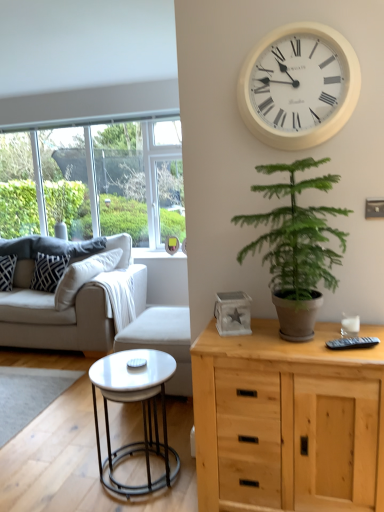
You are a GUI agent. You are given a task and a screenshot of the screen. Output one action in this format:
    pyautogui.click(x=<x>, y=<y>)
    Task: Click on the free space to the left of white fabric armchair at center
    
    Given the screenshot: What is the action you would take?
    pyautogui.click(x=67, y=395)